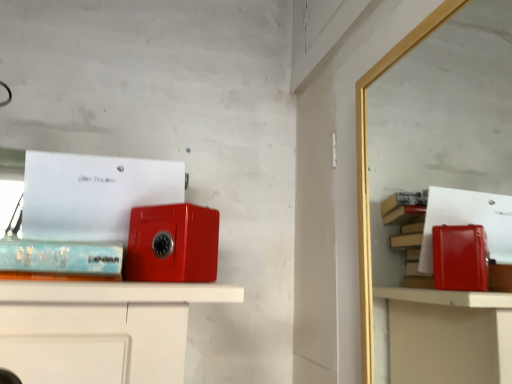
Describe the element at coordinates (172, 244) in the screenshot. I see `matte plastic phone box at center` at that location.

Where is `matte plastic phone box at center`? The height and width of the screenshot is (384, 512). matte plastic phone box at center is located at coordinates (172, 244).

You are a GUI agent. You are given a task and a screenshot of the screen. Output one action in this format:
    pyautogui.click(x=<x>, y=<y>)
    Task: Click on the matte plastic phone box at center
    The width and height of the screenshot is (512, 384).
    Given the screenshot: What is the action you would take?
    172,244